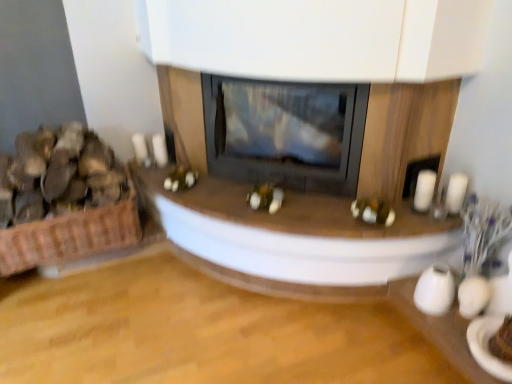
What do you see at coordinates (285, 133) in the screenshot?
I see `black glass wood burning stove at center` at bounding box center [285, 133].

What do you see at coordinates (456, 193) in the screenshot? I see `white glossy candle at right, which ranks as the 1th candle in right-to-left order` at bounding box center [456, 193].

The height and width of the screenshot is (384, 512). What do you see at coordinates (58, 175) in the screenshot? I see `brown woven basket at left` at bounding box center [58, 175].

What do you see at coordinates (70, 235) in the screenshot? The image size is (512, 384). I see `woven brown basket at left` at bounding box center [70, 235].

In order to click on black glass wood burning stove at center in this screenshot , I will do `click(285, 133)`.

Looking at this image, which is correct: woven brown basket at left is inside brown woven basket at left, or outside of it?

woven brown basket at left is not enclosed by brown woven basket at left.

From the image's perspective, is woven brown basket at left below brown woven basket at left?

Indeed, from the image's perspective, woven brown basket at left is shown beneath brown woven basket at left.

In terms of size, does woven brown basket at left appear bigger or smaller than brown woven basket at left?

Clearly, woven brown basket at left is smaller in size than brown woven basket at left.

Does woven brown basket at left have a lesser width compared to brown woven basket at left?

No, woven brown basket at left is not thinner than brown woven basket at left.

Is brown woven basket at left at the back of white matte candle at right, the first candle from the left?

No.

Does point (429, 207) come closer to viewer compared to point (63, 151)?

Yes, it is.

Is white matte candle at right, the second candle when ordered from right to left, in front of brown woven basket at left?

That is False.

What's the angular difference between wooden table at center and white matte candle at right, the first candle from the left,'s facing directions?

0.000901 degrees.

From the image's perspective, is wooden table at center positioned above or below white matte candle at right, the second candle when ordered from right to left?

wooden table at center is below white matte candle at right, the second candle when ordered from right to left.

Is wooden table at center further to camera compared to white matte candle at right, the second candle when ordered from right to left?

No, the depth of wooden table at center is less than that of white matte candle at right, the second candle when ordered from right to left.

How different are the orientations of white glossy candle at right, placed as the second candle when sorted from left to right, and white matte candle at right, the first candle from the left, in degrees?

0.00025 degrees.

From a real-world perspective, is white glossy candle at right, which ranks as the 1th candle in right-to-left order, physically located above or below white matte candle at right, the first candle from the left?

Clearly, from a real-world perspective, white glossy candle at right, which ranks as the 1th candle in right-to-left order, is above white matte candle at right, the first candle from the left.

Does white glossy candle at right, which ranks as the 1th candle in right-to-left order, contain white matte candle at right, the first candle from the left?

That's incorrect, white matte candle at right, the first candle from the left, is not inside white glossy candle at right, which ranks as the 1th candle in right-to-left order.

Which object is closer to the camera, brown woven basket at left or woven brown basket at left?

brown woven basket at left is more forward.

Is woven brown basket at left located within brown woven basket at left?

No, woven brown basket at left is not a part of brown woven basket at left.

Is brown woven basket at left aimed at woven brown basket at left?

No.

Consider the image. From the image's perspective, is black glass wood burning stove at center located beneath white glossy candle at right, placed as the second candle when sorted from left to right?

Actually, black glass wood burning stove at center appears above white glossy candle at right, placed as the second candle when sorted from left to right, in the image.

From their relative heights in the image, would you say black glass wood burning stove at center is taller or shorter than white glossy candle at right, placed as the second candle when sorted from left to right?

Clearly, black glass wood burning stove at center is taller compared to white glossy candle at right, placed as the second candle when sorted from left to right.

Does black glass wood burning stove at center appear on the right side of white glossy candle at right, which ranks as the 1th candle in right-to-left order?

Incorrect, black glass wood burning stove at center is not on the right side of white glossy candle at right, which ranks as the 1th candle in right-to-left order.

Considering the sizes of objects black glass wood burning stove at center and white glossy candle at right, which ranks as the 1th candle in right-to-left order, in the image provided, who is bigger, black glass wood burning stove at center or white glossy candle at right, which ranks as the 1th candle in right-to-left order,?

Bigger between the two is black glass wood burning stove at center.

Is point (310, 178) positioned after point (109, 239)?

No, it is not.

Does black glass wood burning stove at center appear on the left side of woven brown basket at left?

In fact, black glass wood burning stove at center is to the right of woven brown basket at left.

Does black glass wood burning stove at center contain woven brown basket at left?

No, woven brown basket at left is not a part of black glass wood burning stove at center.

Locate an element on the screen. This screenshot has width=512, height=384. food above the woven brown basket at left (from a real-world perspective) is located at coordinates (58, 175).

I want to click on candle that is the 1st object located below the brown woven basket at left (from the image's perspective), so click(x=424, y=190).

When comparing their distances from white matte candle at right, the first candle from the left, does woven brown basket at left or brown woven basket at left seem further?

The object further to white matte candle at right, the first candle from the left, is brown woven basket at left.

Based on their spatial positions, is black glass wood burning stove at center or woven brown basket at left closer to white matte candle at right, the second candle when ordered from right to left?

black glass wood burning stove at center.

When comparing their distances from woven brown basket at left, does white matte candle at right, the second candle when ordered from right to left, or wooden table at center seem closer?

wooden table at center is closer to woven brown basket at left.

Looking at the image, which one is located closer to wooden table at center, woven brown basket at left or white glossy candle at right, placed as the second candle when sorted from left to right?

woven brown basket at left is closer to wooden table at center.

Looking at the image, which one is located further to white matte candle at right, the second candle when ordered from right to left, wooden table at center or brown woven basket at left?

Among the two, brown woven basket at left is located further to white matte candle at right, the second candle when ordered from right to left.

Estimate the real-world distances between objects in this image. Which object is closer to wooden table at center, brown woven basket at left or white glossy candle at right, which ranks as the 1th candle in right-to-left order?

brown woven basket at left.

Which object lies further to the anchor point brown woven basket at left, black glass wood burning stove at center or woven brown basket at left?

The object further to brown woven basket at left is black glass wood burning stove at center.

When comparing their distances from white matte candle at right, the second candle when ordered from right to left, does white glossy candle at right, which ranks as the 1th candle in right-to-left order, or brown woven basket at left seem closer?

white glossy candle at right, which ranks as the 1th candle in right-to-left order.

The width and height of the screenshot is (512, 384). Identify the location of food located between woven brown basket at left and white matte candle at right, the second candle when ordered from right to left, in the left-right direction. (58, 175).

What are the coordinates of `candle situated between woven brown basket at left and white glossy candle at right, placed as the second candle when sorted from left to right, from left to right` in the screenshot? It's located at (424, 190).

The height and width of the screenshot is (384, 512). I want to click on wood burning stove between wooden table at center and white glossy candle at right, which ranks as the 1th candle in right-to-left order, in the horizontal direction, so click(285, 133).

Identify the location of table located between woven brown basket at left and white glossy candle at right, placed as the second candle when sorted from left to right, in the left-right direction. The height and width of the screenshot is (384, 512). (294, 239).